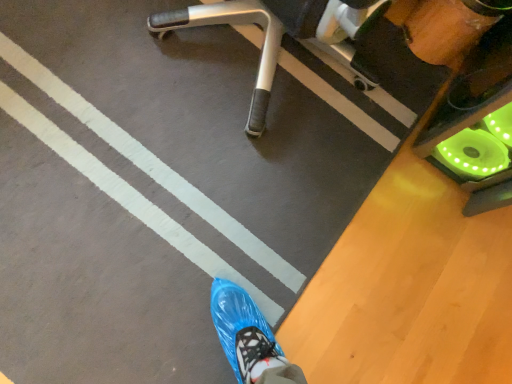
Question: Is matte plastic shoe cover at lower center located outside metallic silver chair at upper center?

Choices:
 (A) yes
 (B) no

Answer: (A)

Question: Can you confirm if matte plastic shoe cover at lower center is positioned to the left of metallic silver chair at upper center?

Choices:
 (A) no
 (B) yes

Answer: (B)

Question: From the image's perspective, is matte plastic shoe cover at lower center under metallic silver chair at upper center?

Choices:
 (A) yes
 (B) no

Answer: (A)

Question: Does matte plastic shoe cover at lower center have a lesser width compared to metallic silver chair at upper center?

Choices:
 (A) yes
 (B) no

Answer: (B)

Question: Considering the relative positions of matte plastic shoe cover at lower center and metallic silver chair at upper center in the image provided, is matte plastic shoe cover at lower center to the right of metallic silver chair at upper center from the viewer's perspective?

Choices:
 (A) no
 (B) yes

Answer: (A)

Question: From a real-world perspective, is matte plastic shoe cover at lower center located beneath metallic silver chair at upper center?

Choices:
 (A) yes
 (B) no

Answer: (A)

Question: Considering the relative positions of metallic silver chair at upper center and matte plastic shoe cover at lower center in the image provided, is metallic silver chair at upper center behind matte plastic shoe cover at lower center?

Choices:
 (A) yes
 (B) no

Answer: (B)

Question: Is the depth of metallic silver chair at upper center less than that of matte plastic shoe cover at lower center?

Choices:
 (A) yes
 (B) no

Answer: (A)

Question: From the image's perspective, would you say metallic silver chair at upper center is shown under matte plastic shoe cover at lower center?

Choices:
 (A) no
 (B) yes

Answer: (A)

Question: Is metallic silver chair at upper center not near matte plastic shoe cover at lower center?

Choices:
 (A) yes
 (B) no

Answer: (B)

Question: Does metallic silver chair at upper center appear on the right side of matte plastic shoe cover at lower center?

Choices:
 (A) yes
 (B) no

Answer: (A)

Question: From a real-world perspective, is metallic silver chair at upper center positioned over matte plastic shoe cover at lower center based on gravity?

Choices:
 (A) no
 (B) yes

Answer: (B)

Question: Relative to matte plastic shoe cover at lower center, is metallic silver chair at upper center in front or behind?

Choices:
 (A) behind
 (B) front

Answer: (B)